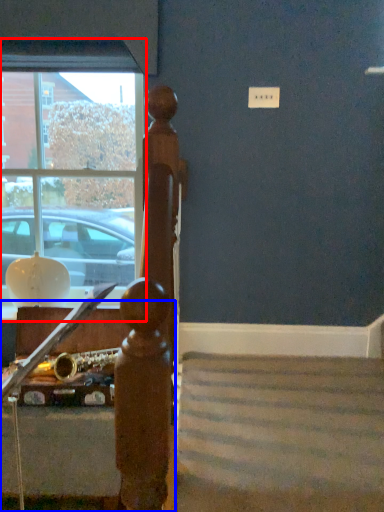
Question: Which point is further to the camera, window (highlighted by a red box) or furniture (highlighted by a blue box)?

Choices:
 (A) window
 (B) furniture

Answer: (A)